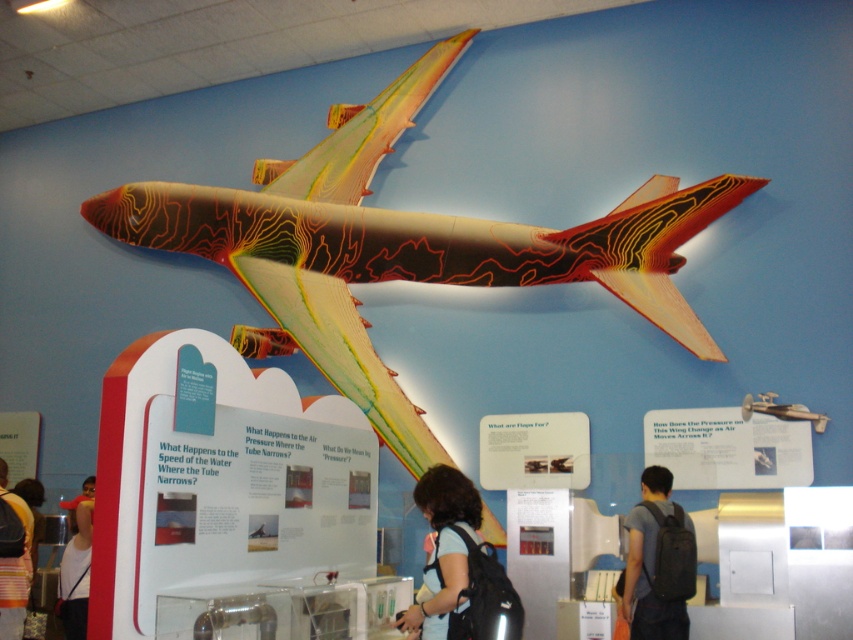
Image resolution: width=853 pixels, height=640 pixels. Describe the element at coordinates (405, 244) in the screenshot. I see `multicolored painted airplane at upper center` at that location.

Is multicolored painted airplane at upper center to the right of black backpack at lower right from the viewer's perspective?

No, multicolored painted airplane at upper center is not to the right of black backpack at lower right.

Where is `multicolored painted airplane at upper center`? multicolored painted airplane at upper center is located at coordinates (405, 244).

Is black backpack at lower right above striped backpack at lower left?

Yes.

Measure the distance from black backpack at lower right to striped backpack at lower left.

The distance of black backpack at lower right from striped backpack at lower left is 10.51 feet.

Is point (634, 570) closer to camera compared to point (6, 499)?

Yes, it is.

The width and height of the screenshot is (853, 640). I want to click on black backpack at lower right, so click(659, 561).

Is point (637, 579) farther from viewer compared to point (471, 497)?

Yes, it is.

Can you confirm if black backpack at lower right is smaller than dark brown hair at center?

No.

What are the coordinates of `black backpack at lower right` in the screenshot? It's located at (659, 561).